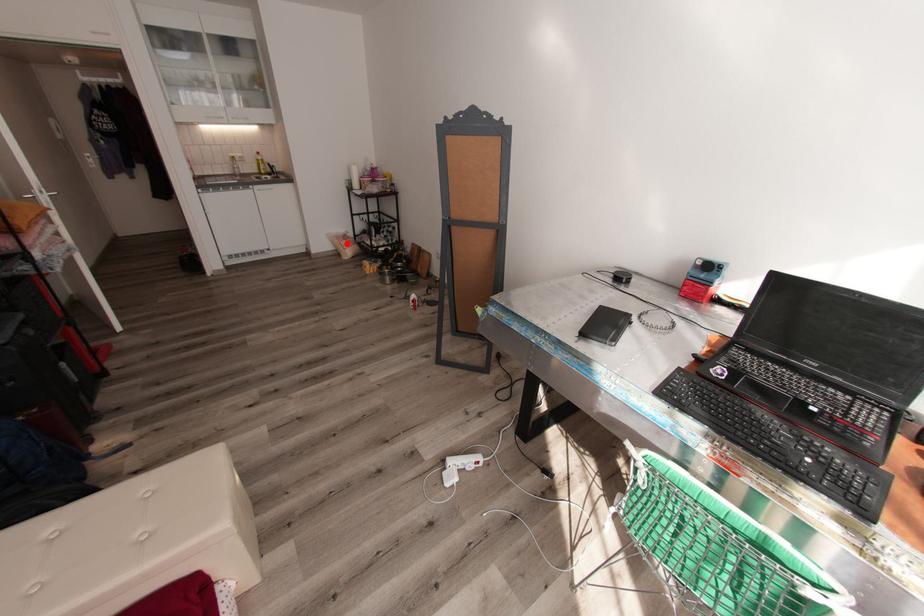
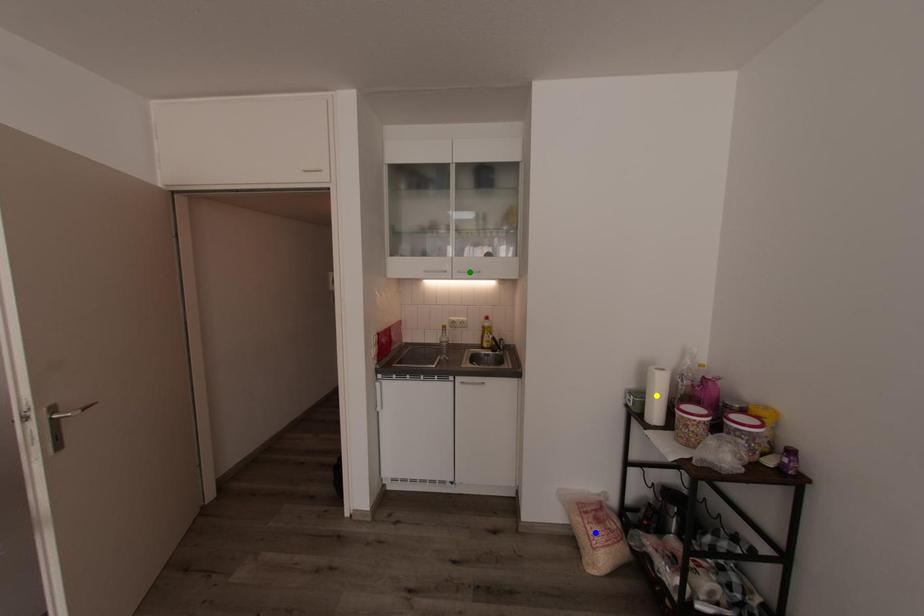
Question: I am providing you with two images of the same scene from different viewpoints. A red point is marked on the first image. You are given multiple points on the second image. Which mark in image 2 goes with the point in image 1?

Choices:
 (A) yellow point
 (B) green point
 (C) blue point

Answer: (C)